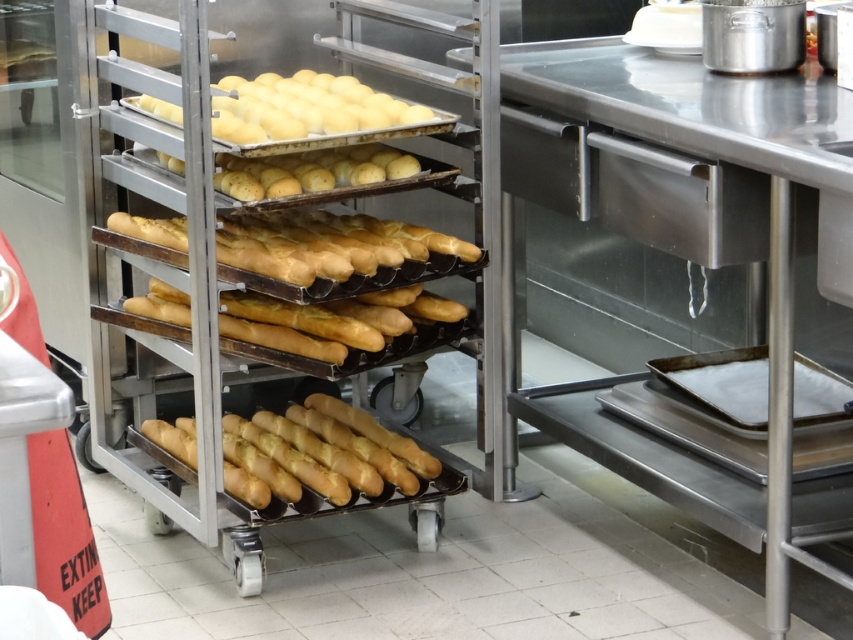
Question: Can you confirm if golden matte baguette at center is positioned to the left of golden matte baguettes at center?

Choices:
 (A) yes
 (B) no

Answer: (A)

Question: Which of these objects is positioned farthest from the yellow matte doughnuts at center?

Choices:
 (A) golden matte baguettes at center
 (B) golden matte baguette at center
 (C) smooth golden bread at center

Answer: (B)

Question: Is yellow matte doughnuts at center thinner than smooth golden bread at center?

Choices:
 (A) yes
 (B) no

Answer: (B)

Question: Which point is closer to the camera?

Choices:
 (A) golden matte baguettes at center
 (B) yellow matte doughnuts at center
 (C) golden matte baguette at center
 (D) smooth golden bread at center

Answer: (B)

Question: Does golden matte baguettes at center have a smaller size compared to smooth golden bread at center?

Choices:
 (A) no
 (B) yes

Answer: (A)

Question: Which object is farther from the camera taking this photo?

Choices:
 (A) golden matte baguettes at center
 (B) yellow matte doughnuts at center
 (C) smooth golden bread at center

Answer: (A)